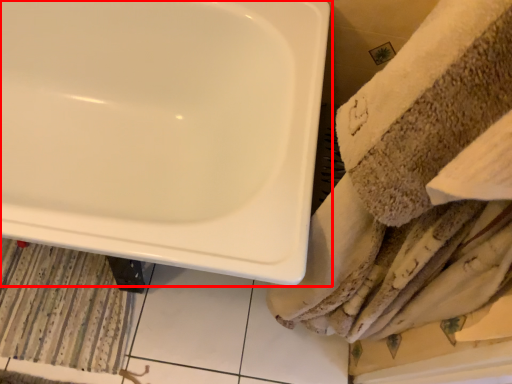
Question: Considering the relative positions of sink (annotated by the red box) and bath mat in the image provided, where is sink (annotated by the red box) located with respect to the staircase?

Choices:
 (A) right
 (B) left

Answer: (A)